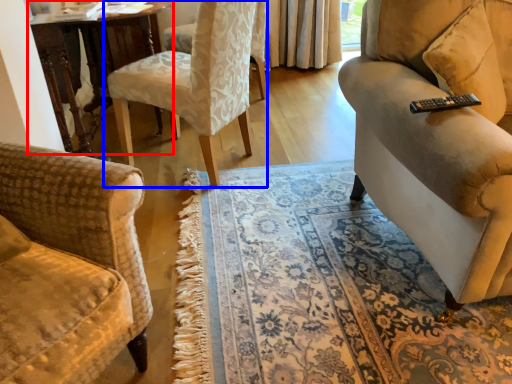
Question: Which of the following is the closest to the observer, table (highlighted by a red box) or chair (highlighted by a blue box)?

Choices:
 (A) table
 (B) chair

Answer: (B)